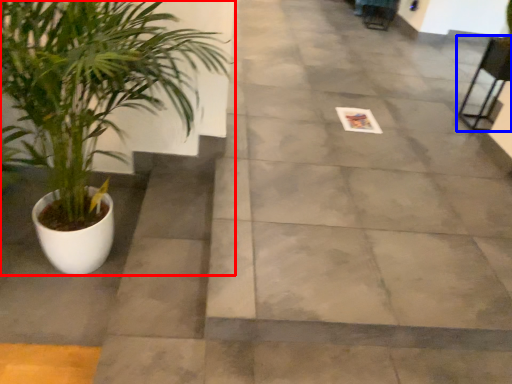
Question: Which object is closer to the camera taking this photo, houseplant (highlighted by a red box) or chair (highlighted by a blue box)?

Choices:
 (A) houseplant
 (B) chair

Answer: (A)